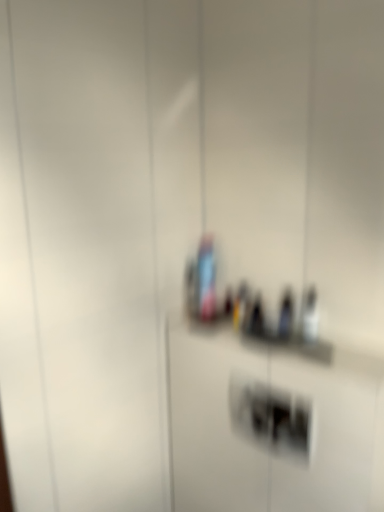
The image size is (384, 512). What do you see at coordinates (206, 278) in the screenshot?
I see `translucent glass bottle at center` at bounding box center [206, 278].

Find the location of a particular element. The image size is (384, 512). translucent glass bottle at center is located at coordinates (206, 278).

In order to face white plastic light switch at center, should I rotate leftwards or rightwards?

It's best to rotate right around 9.214 degrees.

What do you see at coordinates (271, 416) in the screenshot? This screenshot has height=512, width=384. I see `white plastic light switch at center` at bounding box center [271, 416].

Locate an element on the screen. Image resolution: width=384 pixels, height=512 pixels. white plastic light switch at center is located at coordinates (271, 416).

What is the approximate height of white plastic light switch at center?

It is 6.60 inches.

Locate an element on the screen. translucent glass bottle at center is located at coordinates (206, 278).

In the image, is translucent glass bottle at center on the left side or the right side of white plastic light switch at center?

From the image, it's evident that translucent glass bottle at center is to the left of white plastic light switch at center.

In the image, is translucent glass bottle at center positioned in front of or behind white plastic light switch at center?

Clearly, translucent glass bottle at center is behind white plastic light switch at center.

Between point (212, 255) and point (254, 399), which one is positioned behind?

Point (212, 255)

From the image's perspective, would you say translucent glass bottle at center is shown under white plastic light switch at center?

Incorrect, from the image's perspective, translucent glass bottle at center is higher than white plastic light switch at center.

From a real-world perspective, between translucent glass bottle at center and white plastic light switch at center, who is vertically higher?

From a 3D spatial view, translucent glass bottle at center is above.

Is translucent glass bottle at center wider than white plastic light switch at center?

Correct, the width of translucent glass bottle at center exceeds that of white plastic light switch at center.

Is translucent glass bottle at center taller than white plastic light switch at center?

Yes.

Does translucent glass bottle at center have a smaller size compared to white plastic light switch at center?

Indeed, translucent glass bottle at center has a smaller size compared to white plastic light switch at center.

Is translucent glass bottle at center outside of white plastic light switch at center?

Yes.

Is translucent glass bottle at center next to white plastic light switch at center?

No, translucent glass bottle at center is not touching white plastic light switch at center.

Could you tell me if translucent glass bottle at center is facing white plastic light switch at center?

No.

Locate an element on the screen. The image size is (384, 512). bottle above the white plastic light switch at center (from a real-world perspective) is located at coordinates (206, 278).

Would you say white plastic light switch at center is to the left or to the right of translucent glass bottle at center in the picture?

white plastic light switch at center is to the right of translucent glass bottle at center.

Is the depth of white plastic light switch at center greater than that of translucent glass bottle at center?

No, it is not.

Considering the positions of point (280, 400) and point (205, 268), is point (280, 400) closer or farther from the camera than point (205, 268)?

Point (280, 400) is positioned closer to the camera compared to point (205, 268).

From the image's perspective, between white plastic light switch at center and translucent glass bottle at center, who is located below?

white plastic light switch at center, from the image's perspective.

From a real-world perspective, which is physically above, white plastic light switch at center or translucent glass bottle at center?

From a 3D spatial view, translucent glass bottle at center is above.

Between white plastic light switch at center and translucent glass bottle at center, which one has smaller width?

With smaller width is white plastic light switch at center.

Considering the relative sizes of white plastic light switch at center and translucent glass bottle at center in the image provided, is white plastic light switch at center shorter than translucent glass bottle at center?

Yes, white plastic light switch at center is shorter than translucent glass bottle at center.

Does white plastic light switch at center have a smaller size compared to translucent glass bottle at center?

No, white plastic light switch at center is not smaller than translucent glass bottle at center.

From the picture: Would you say white plastic light switch at center contains translucent glass bottle at center?

Definitely not — translucent glass bottle at center is not inside white plastic light switch at center.

Are white plastic light switch at center and translucent glass bottle at center located far from each other?

No, white plastic light switch at center is not far away from translucent glass bottle at center.

Is white plastic light switch at center aimed at translucent glass bottle at center?

No, white plastic light switch at center is not aimed at translucent glass bottle at center.

How different are the orientations of white plastic light switch at center and translucent glass bottle at center in degrees?

The facing directions of white plastic light switch at center and translucent glass bottle at center are 0.00288 degrees apart.

Where is `light switch in front of the translucent glass bottle at center`? The height and width of the screenshot is (512, 384). light switch in front of the translucent glass bottle at center is located at coordinates (271, 416).

The height and width of the screenshot is (512, 384). Identify the location of bottle above the white plastic light switch at center (from the image's perspective). (206, 278).

Locate an element on the screen. Image resolution: width=384 pixels, height=512 pixels. light switch that appears in front of the translucent glass bottle at center is located at coordinates (271, 416).